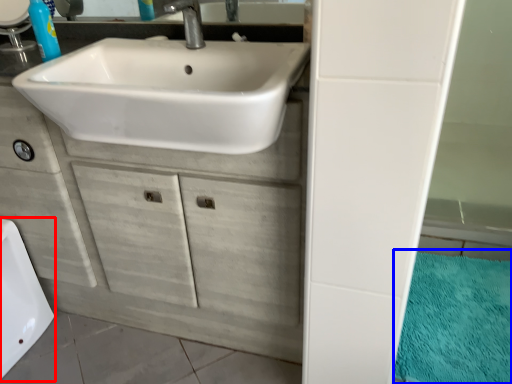
Question: Which object appears farthest to the camera in this image, bath (highlighted by a red box) or bath mat (highlighted by a blue box)?

Choices:
 (A) bath
 (B) bath mat

Answer: (A)